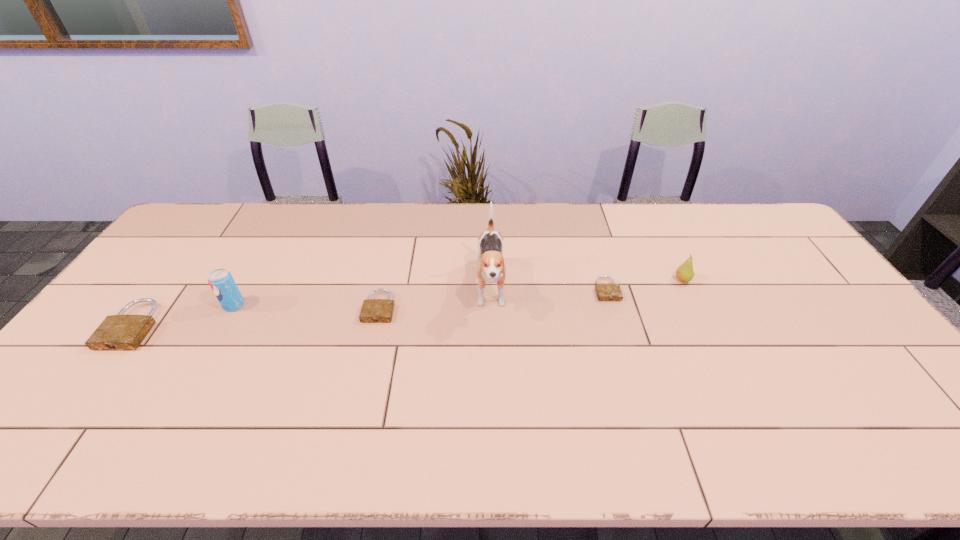
Where is `vacant area at the near edge`? The width and height of the screenshot is (960, 540). vacant area at the near edge is located at coordinates (140, 397).

Find the location of `vacant area at the left edge of the desktop`. vacant area at the left edge of the desktop is located at coordinates (175, 297).

The image size is (960, 540). I want to click on vacant space at the right edge of the desktop, so click(766, 269).

I want to click on vacant area at the far left corner, so click(x=239, y=207).

Identify the location of vacant region at the near left corner of the desktop. The image size is (960, 540). (53, 415).

Where is `free space between the fourth object from left to right and the second padlock from right to left`? This screenshot has height=540, width=960. free space between the fourth object from left to right and the second padlock from right to left is located at coordinates (435, 298).

The image size is (960, 540). I want to click on vacant area that lies between the pear and the tallest padlock, so [x=408, y=303].

Where is `empty space between the second tallest padlock and the shortest padlock`? empty space between the second tallest padlock and the shortest padlock is located at coordinates (493, 298).

In order to click on unoccupied position between the rightmost padlock and the rightmost object in this screenshot , I will do `click(644, 285)`.

Where is `free space between the soda can and the pear`? free space between the soda can and the pear is located at coordinates (458, 293).